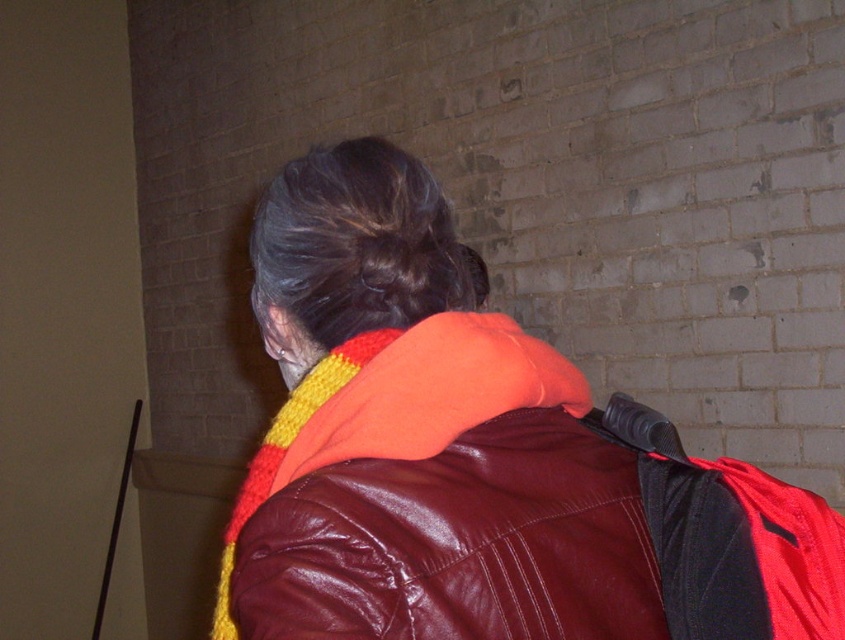
Question: Observing the image, what is the correct spatial positioning of dark brown hair at center in reference to black leather backpack at upper right?

Choices:
 (A) left
 (B) right

Answer: (A)

Question: Can you confirm if leather jacket at center is wider than burgundy leather jacket at center?

Choices:
 (A) no
 (B) yes

Answer: (B)

Question: Is leather jacket at center closer to the viewer compared to dark brown hair at center?

Choices:
 (A) yes
 (B) no

Answer: (A)

Question: Which object appears closest to the camera in this image?

Choices:
 (A) burgundy leather jacket at center
 (B) leather jacket at center
 (C) dark brown hair at center
 (D) black leather backpack at upper right

Answer: (B)

Question: Which point appears closest to the camera in this image?

Choices:
 (A) (634, 582)
 (B) (718, 556)

Answer: (A)

Question: Which object is positioned closest to the black leather backpack at upper right?

Choices:
 (A) burgundy leather jacket at center
 (B) leather jacket at center
 (C) dark brown hair at center

Answer: (A)